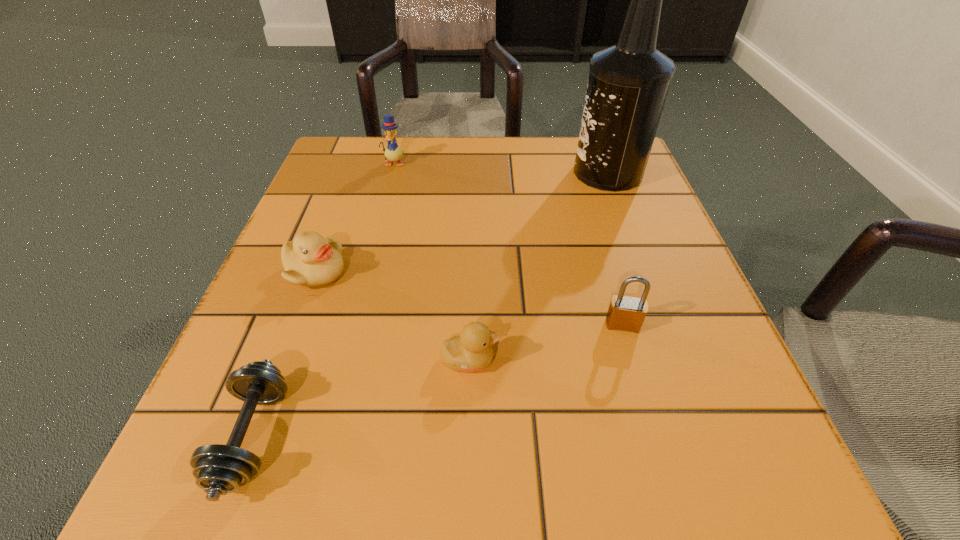
Find the location of `dumbbell situated at the left edge`. dumbbell situated at the left edge is located at coordinates (219, 469).

Identify the location of liquor that is at the right edge. (628, 83).

Image resolution: width=960 pixels, height=540 pixels. Find the location of `padlock located at the right edge`. padlock located at the right edge is located at coordinates (625, 313).

The height and width of the screenshot is (540, 960). In order to click on object located in the far left corner section of the desktop in this screenshot , I will do `click(392, 152)`.

Find the location of a particular element. This screenshot has height=540, width=960. object located at the near left corner is located at coordinates coord(219,469).

Find the location of a particular element. This screenshot has width=960, height=540. object at the far right corner is located at coordinates (628, 83).

The image size is (960, 540). In the image, there is a desktop. What are the coordinates of `vacant space at the far edge` in the screenshot? It's located at (491, 193).

At what (x,y) coordinates should I click in order to perform the action: click on free region at the near edge. Please return your answer as a coordinate pair (x, y). The height and width of the screenshot is (540, 960). Looking at the image, I should click on (590, 472).

The image size is (960, 540). In the image, there is a desktop. Identify the location of vacant space at the left edge. (253, 328).

In the image, there is a desktop. At what (x,y) coordinates should I click in order to perform the action: click on vacant space at the right edge. Please return your answer as a coordinate pair (x, y). This screenshot has height=540, width=960. Looking at the image, I should click on (641, 197).